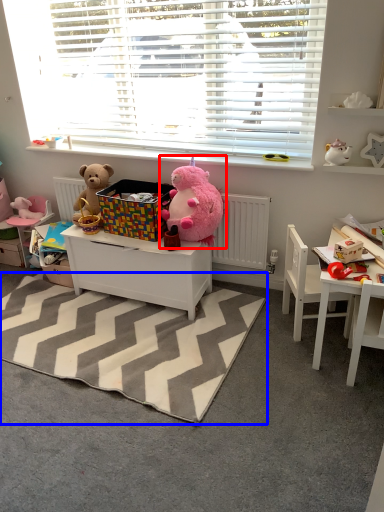
Question: Which of the following is the farthest to the observer, teddy bear (highlighted by a red box) or mat (highlighted by a blue box)?

Choices:
 (A) teddy bear
 (B) mat

Answer: (A)